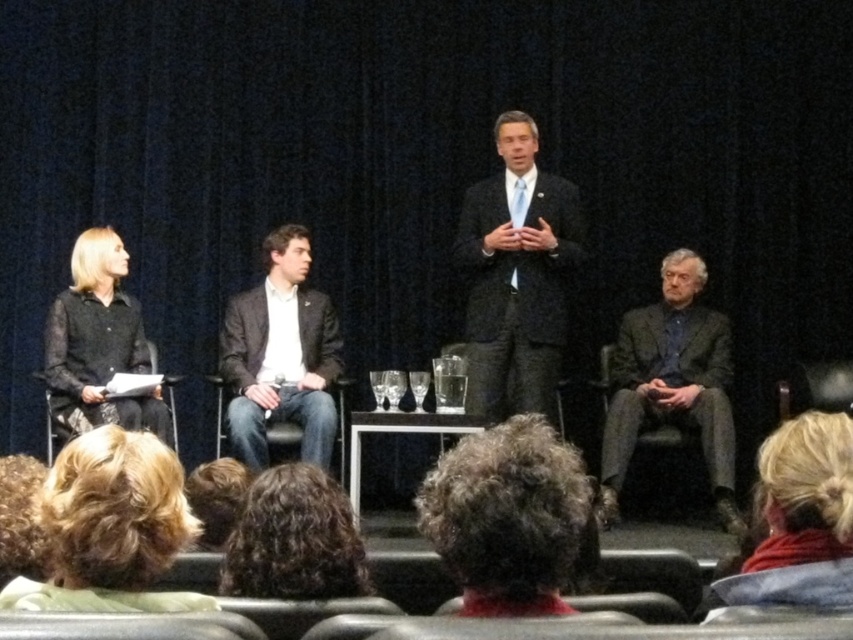
Question: Can you confirm if dark curly hair at center is positioned to the right of white shirt at center?

Choices:
 (A) no
 (B) yes

Answer: (B)

Question: Is white shirt at center further to the viewer compared to blonde hair at lower right?

Choices:
 (A) yes
 (B) no

Answer: (A)

Question: Among these objects, which one is farthest from the camera?

Choices:
 (A) blonde hair at lower right
 (B) curly brown hair at lower left

Answer: (B)

Question: Based on their relative distances, which object is farther from the dark gray suit at center?

Choices:
 (A) curly brown hair at lower left
 (B) dark curly hair at center
 (C) blonde hair at lower right

Answer: (A)

Question: Among these objects, which one is nearest to the camera?

Choices:
 (A) curly brown hair at lower left
 (B) blonde hair at lower right

Answer: (B)

Question: Considering the relative positions of dark gray suit at center and dark curly hair at center in the image provided, where is dark gray suit at center located with respect to dark curly hair at center?

Choices:
 (A) left
 (B) right

Answer: (B)